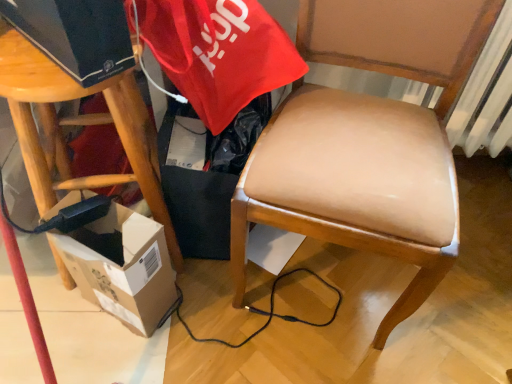
I want to click on spots to the right of cardboard box at lower left, so click(x=220, y=324).